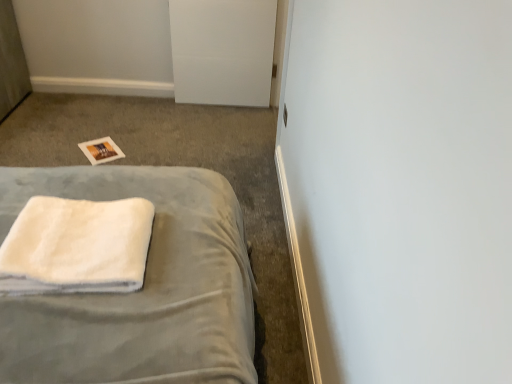
Where is `free area below white matte door at upper center (from a real-world perspective)`? free area below white matte door at upper center (from a real-world perspective) is located at coordinates (216, 102).